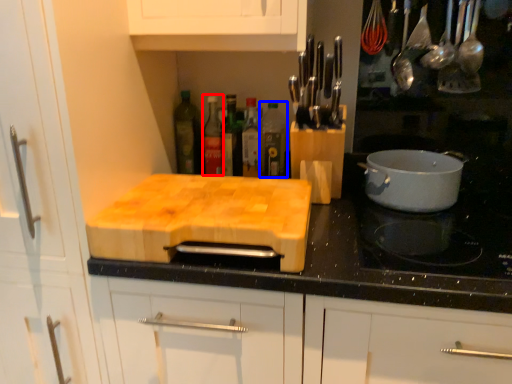
Question: Which of the following is the farthest to the observer, bottle (highlighted by a red box) or bottle (highlighted by a blue box)?

Choices:
 (A) bottle
 (B) bottle

Answer: (A)